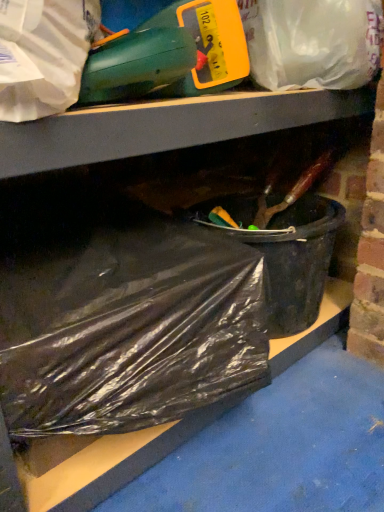
Question: Considering the positions of translucent plastic bag at upper center, the first plastic bag when ordered from top to bottom, and black plastic bucket at lower right in the image, is translucent plastic bag at upper center, the first plastic bag when ordered from top to bottom, wider or thinner than black plastic bucket at lower right?

Choices:
 (A) wide
 (B) thin

Answer: (A)

Question: Is translucent plastic bag at upper center, which is the 2th plastic bag in bottom-to-top order, inside the boundaries of black plastic bucket at lower right, or outside?

Choices:
 (A) inside
 (B) outside

Answer: (B)

Question: Estimate the real-world distances between objects in this image. Which object is closer to the translucent plastic bag at upper center, which is the 2th plastic bag in bottom-to-top order?

Choices:
 (A) black plastic bag at lower left, the first plastic bag ordered from the bottom
 (B) black plastic bucket at lower right

Answer: (B)

Question: Estimate the real-world distances between objects in this image. Which object is closer to the black plastic bucket at lower right?

Choices:
 (A) black plastic bag at lower left, the first plastic bag ordered from the bottom
 (B) translucent plastic bag at upper center, which is the 2th plastic bag in bottom-to-top order

Answer: (A)